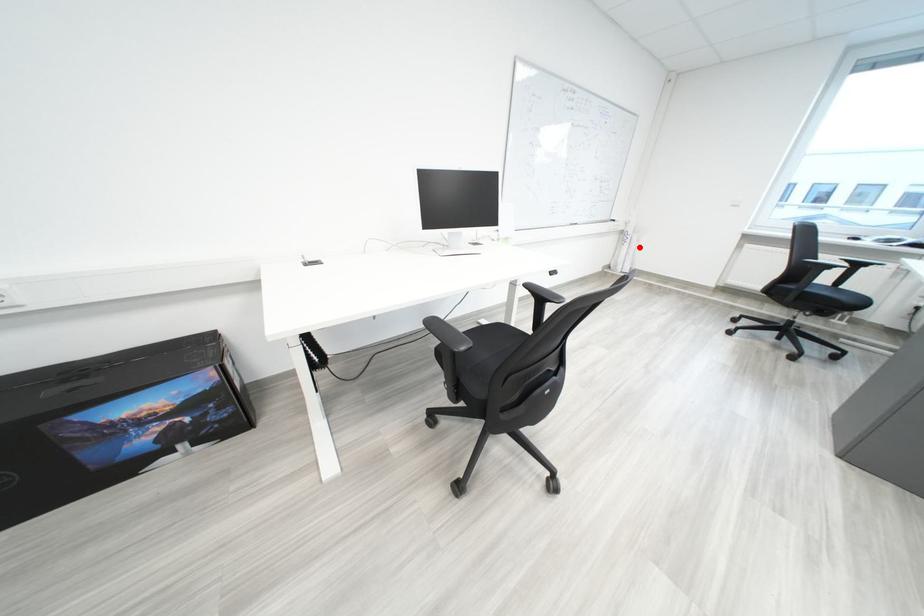
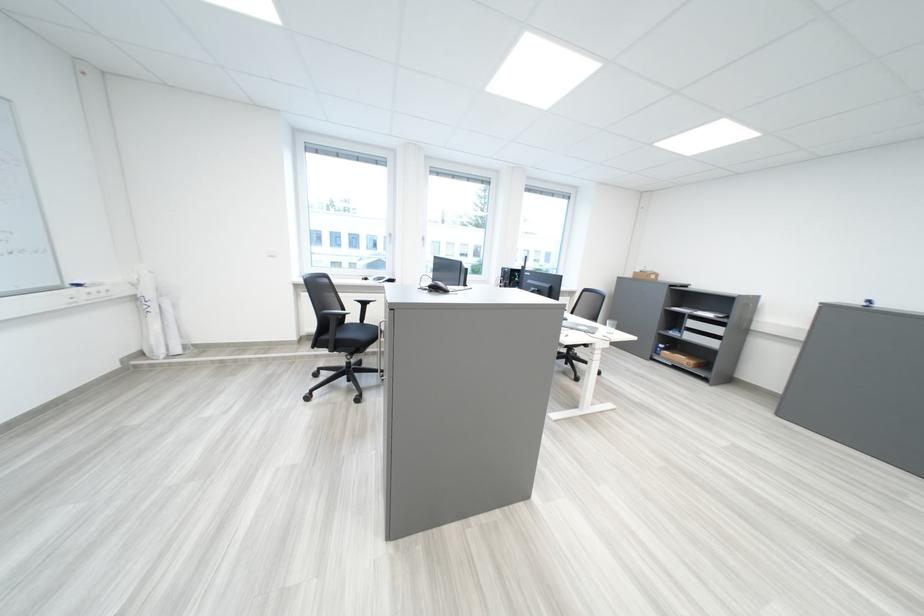
In the second image, find the point that corresponds to the highlighted location in the first image.

(166, 318)